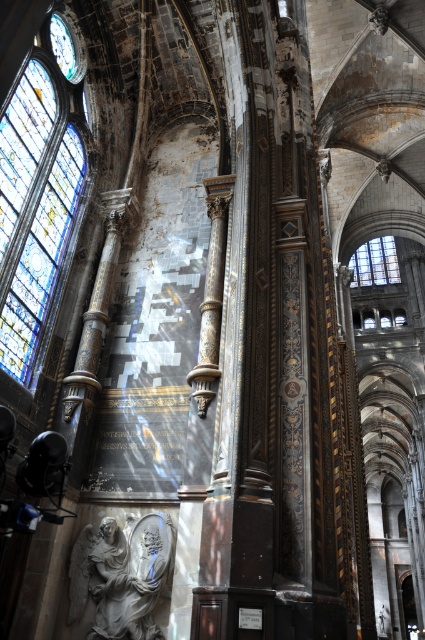
You are an architect analyzing the cathedral design. You need to determine which stained glass window is taller between the stained glass window at left and the stained glass window at upper right. Based on the scene, which one is taller?

The stained glass window at left is taller than the stained glass window at upper right.

You are standing at the center of the cathedral and want to locate the stained glass window at left. According to the coordinates provided, where should you look to find it?

The stained glass window at left is located at the coordinates point [39,193], so you should look to the left side of the cathedral, slightly above the lower edge to find it.

You are an interior designer planning to place a new decorative item in the cathedral. The item must be placed between the white marble statue at center and the metallic clock face at upper left. Considering their widths, which object should you use as a reference for the placement to ensure the new item fits appropriately?

The white marble statue at center is wider than the metallic clock face at upper left. Therefore, using the white marble statue at center as the reference ensures the new item will fit within the available space.